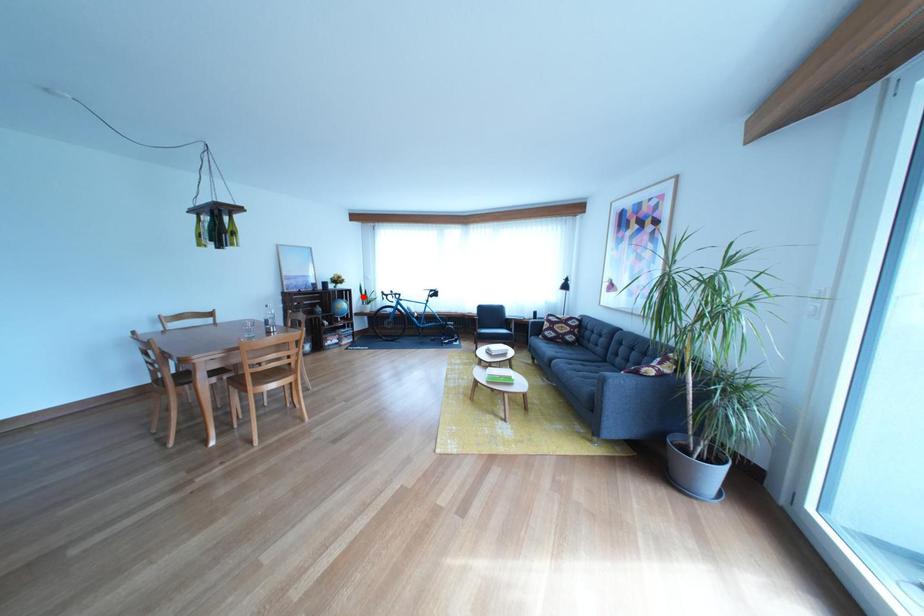
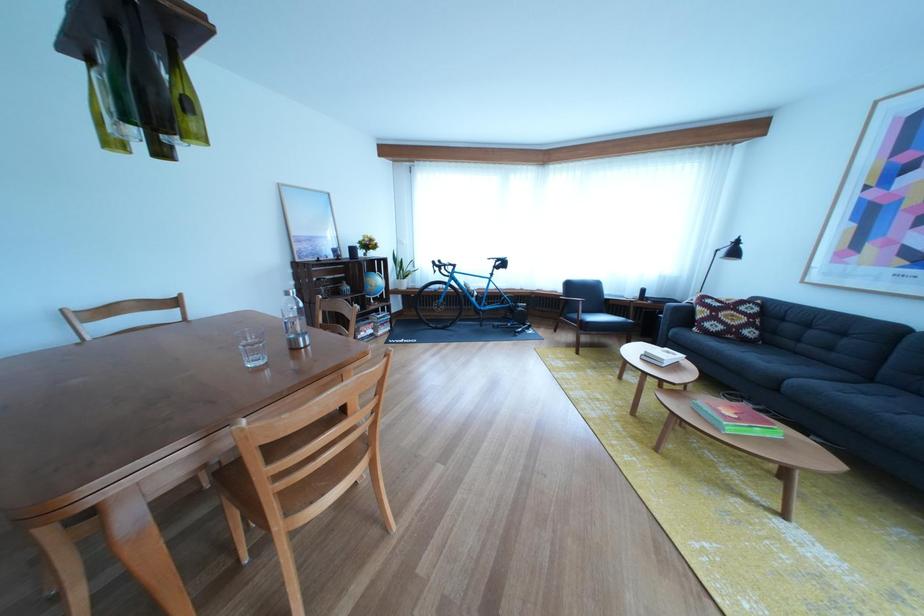
Where in the second image is the point corresponding to the highlighted location from the first image?

(398, 265)